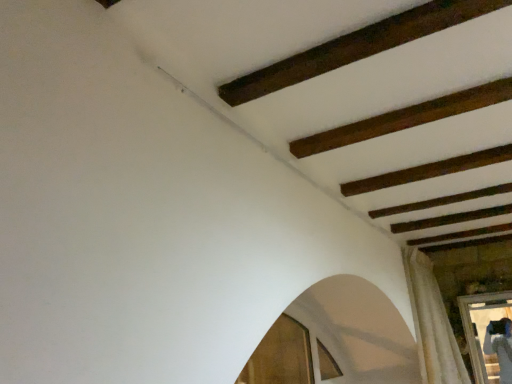
Image resolution: width=512 pixels, height=384 pixels. I want to click on white textured curtain at lower right, so click(x=432, y=323).

From the picture: Measure the distance between point (x=434, y=380) and camera.

The distance of point (x=434, y=380) from camera is 8.53 feet.

The width and height of the screenshot is (512, 384). Describe the element at coordinates (432, 323) in the screenshot. I see `white textured curtain at lower right` at that location.

What is the approximate height of wooden frame at lower right?

The height of wooden frame at lower right is 24.51 inches.

This screenshot has width=512, height=384. Describe the element at coordinates (488, 335) in the screenshot. I see `wooden frame at lower right` at that location.

The width and height of the screenshot is (512, 384). Identify the location of wooden frame at lower right. (488, 335).

Find the location of a particular element. This screenshot has width=512, height=384. white textured curtain at lower right is located at coordinates (432, 323).

Is wooden frame at lower right at the left side of white textured curtain at lower right?

No, wooden frame at lower right is not to the left of white textured curtain at lower right.

Consider the image. Relative to white textured curtain at lower right, is wooden frame at lower right in front or behind?

Clearly, wooden frame at lower right is behind white textured curtain at lower right.

Which is behind, point (475, 307) or point (459, 366)?

The point (475, 307) is behind.

From the image's perspective, between wooden frame at lower right and white textured curtain at lower right, which one is located above?

white textured curtain at lower right, from the image's perspective.

From a real-world perspective, who is located higher, wooden frame at lower right or white textured curtain at lower right?

From a 3D spatial view, white textured curtain at lower right is above.

Considering the sizes of wooden frame at lower right and white textured curtain at lower right in the image, is wooden frame at lower right wider or thinner than white textured curtain at lower right?

In the image, wooden frame at lower right appears to be more narrow than white textured curtain at lower right.

Based on the photo, which of these two, wooden frame at lower right or white textured curtain at lower right, stands taller?

white textured curtain at lower right is taller.

Does wooden frame at lower right have a larger size compared to white textured curtain at lower right?

No.

Is white textured curtain at lower right surrounded by wooden frame at lower right?

Definitely not — white textured curtain at lower right is not inside wooden frame at lower right.

Is wooden frame at lower right far from white textured curtain at lower right?

No, there isn't a large distance between wooden frame at lower right and white textured curtain at lower right.

Is wooden frame at lower right oriented towards white textured curtain at lower right?

Yes, wooden frame at lower right is oriented towards white textured curtain at lower right.

How different are the orientations of wooden frame at lower right and white textured curtain at lower right in degrees?

They differ by 88.4 degrees in their facing directions.

Identify the location of window frame to the right of white textured curtain at lower right. (488, 335).

Would you say white textured curtain at lower right is to the left or to the right of wooden frame at lower right in the picture?

white textured curtain at lower right is positioned on wooden frame at lower right's left side.

Is white textured curtain at lower right in front of wooden frame at lower right?

Yes, the depth of white textured curtain at lower right is less than that of wooden frame at lower right.

Between point (423, 322) and point (496, 361), which one is positioned behind?

The point (496, 361) is more distant.

From the image's perspective, is white textured curtain at lower right above wooden frame at lower right?

Correct, white textured curtain at lower right appears higher than wooden frame at lower right in the image.

From a real-world perspective, is white textured curtain at lower right physically located above or below wooden frame at lower right?

white textured curtain at lower right is above wooden frame at lower right.

Can you confirm if white textured curtain at lower right is thinner than wooden frame at lower right?

No, white textured curtain at lower right is not thinner than wooden frame at lower right.

Is white textured curtain at lower right taller than wooden frame at lower right?

Correct, white textured curtain at lower right is much taller as wooden frame at lower right.

Is white textured curtain at lower right bigger than wooden frame at lower right?

Yes.

Is white textured curtain at lower right spatially inside wooden frame at lower right, or outside of it?

white textured curtain at lower right is not enclosed by wooden frame at lower right.

Would you say white textured curtain at lower right is a long distance from wooden frame at lower right?

They are positioned close to each other.

Is white textured curtain at lower right turned away from wooden frame at lower right?

No, white textured curtain at lower right's orientation is not away from wooden frame at lower right.

The image size is (512, 384). Find the location of `window frame behind the white textured curtain at lower right`. window frame behind the white textured curtain at lower right is located at coordinates (488, 335).

I want to click on curtain on the left of the wooden frame at lower right, so click(x=432, y=323).

At what (x,y) coordinates should I click in order to perform the action: click on window frame below the white textured curtain at lower right (from the image's perspective). Please return your answer as a coordinate pair (x, y). Image resolution: width=512 pixels, height=384 pixels. Looking at the image, I should click on (488, 335).